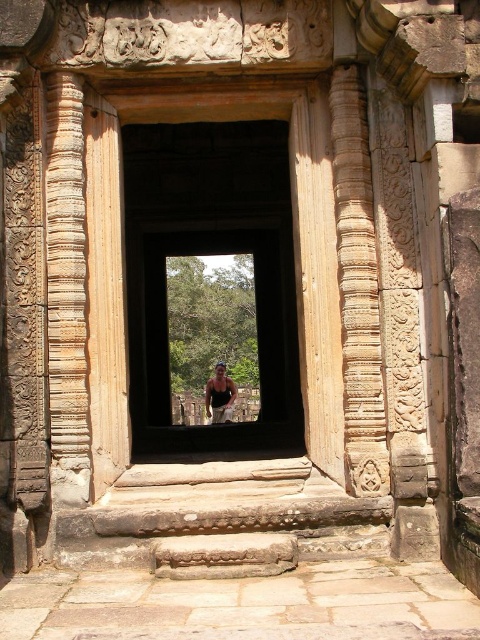
You are standing in front of an ancient Khmer temple. You see the brown stone door at center. If you want to reach the door, which direction should you move relative to your current position?

Since the brown stone door at center is located at coordinates approximately 0.366 on the x and 0.610 on the y axis, you should move forward towards the center of the image to reach it.

You are standing in front of the ancient temple doorway. There are two points marked on the doorway structure. The first point is at coordinates point (343,480) and the second is at point (222,371). Which of these two points is closer to your current position?

Point (343,480) is closer to the camera than point (222,371), so the first point is closer to your current position.